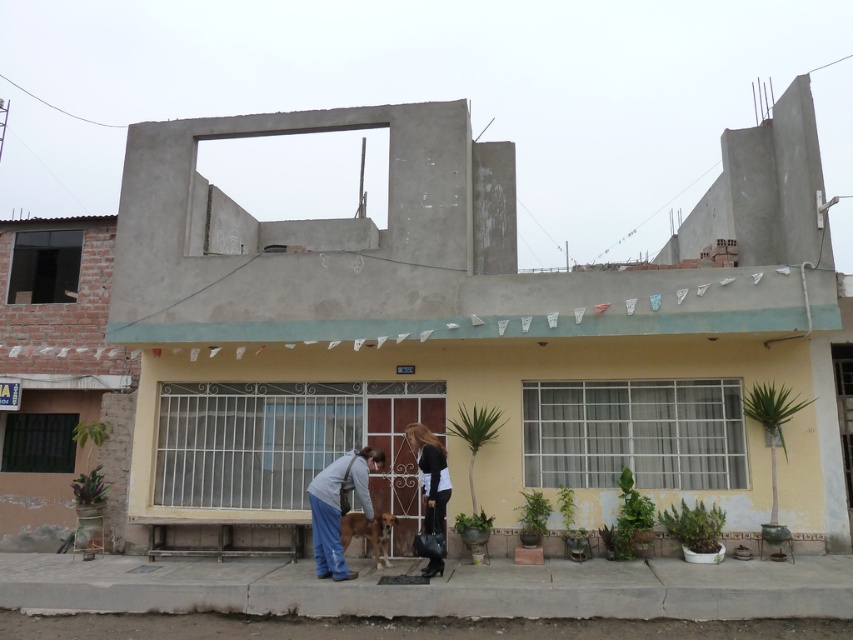
Question: Among these points, which one is farthest from the camera?

Choices:
 (A) (352, 516)
 (B) (422, 468)
 (C) (347, 481)

Answer: (B)

Question: Which point is closer to the camera taking this photo?

Choices:
 (A) (369, 456)
 (B) (364, 524)

Answer: (B)

Question: Is the position of blue jeans at center less distant than that of brown fur dog at center?

Choices:
 (A) no
 (B) yes

Answer: (B)

Question: Can you confirm if blue jeans at center is wider than dark brown hair at center?

Choices:
 (A) yes
 (B) no

Answer: (A)

Question: Does dark brown hair at center have a smaller size compared to brown fur dog at center?

Choices:
 (A) yes
 (B) no

Answer: (B)

Question: Which object appears farthest from the camera in this image?

Choices:
 (A) brown fur dog at center
 (B) dark brown hair at center

Answer: (B)